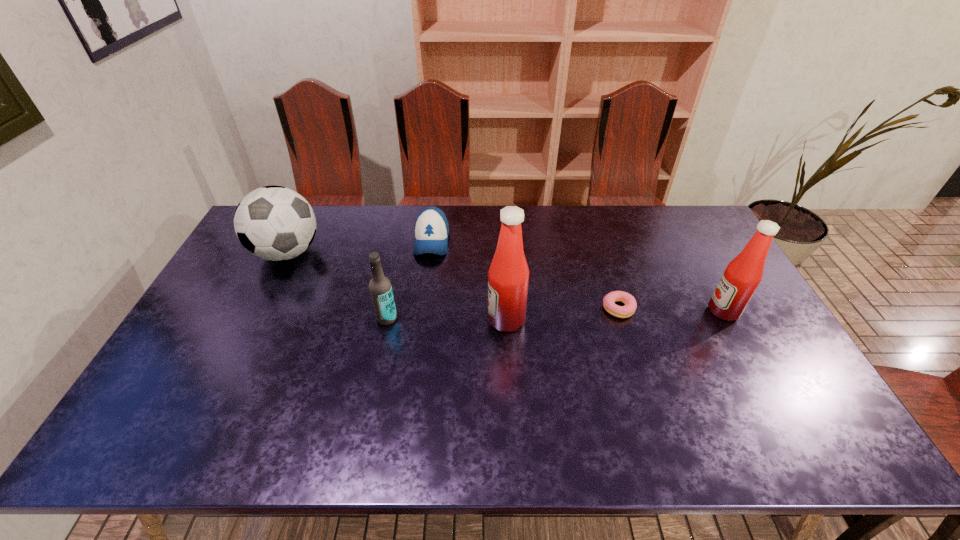
You are a GUI agent. You are given a task and a screenshot of the screen. Output one action in this format:
    pyautogui.click(x=<x>, y=<y>)
    Task: Click on the free space located 0.130m on the front-facing side of the taller condiment
    This screenshot has height=540, width=960.
    Given the screenshot: What is the action you would take?
    pyautogui.click(x=443, y=320)

This screenshot has height=540, width=960. I want to click on vacant region located on the front-facing side of the taller condiment, so click(412, 320).

In order to click on blank area located 0.350m on the front-facing side of the taller condiment in this screenshot , I will do pos(367,320).

Where is `vacant region located 0.070m on the front-facing side of the second tallest object`? vacant region located 0.070m on the front-facing side of the second tallest object is located at coordinates (685, 311).

The height and width of the screenshot is (540, 960). What are the coordinates of `free space located 0.270m on the front-facing side of the second tallest object` in the screenshot? It's located at (617, 311).

Where is `vacant space located on the front-facing side of the second tallest object`? The width and height of the screenshot is (960, 540). vacant space located on the front-facing side of the second tallest object is located at coordinates (682, 311).

Where is `vacant space located on the front-facing side of the baseball cap`? The height and width of the screenshot is (540, 960). vacant space located on the front-facing side of the baseball cap is located at coordinates (426, 284).

The width and height of the screenshot is (960, 540). Find the location of `free space located on the main logo of the soccer ball`. free space located on the main logo of the soccer ball is located at coordinates (233, 361).

Identify the location of vacant space located on the side of the beer bottle with the label. The height and width of the screenshot is (540, 960). (371, 397).

Identify the location of free space located on the left of the shortest object. (552, 308).